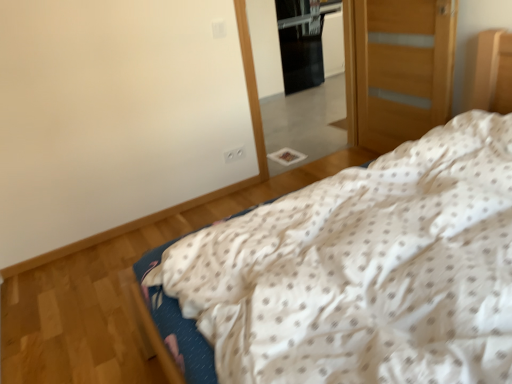
Identify the location of clear glass mirror at center. (298, 92).

In order to click on black glass screen door at upper center in this screenshot , I will do `click(300, 44)`.

The width and height of the screenshot is (512, 384). Find the location of `white dotted fabric at center`. white dotted fabric at center is located at coordinates (359, 270).

Find the location of `wooden door at right`. wooden door at right is located at coordinates (399, 69).

This screenshot has height=384, width=512. I want to click on clear glass mirror at center, so (x=298, y=92).

How much distance is there between wooden door at right and black glass screen door at upper center?

2.22 meters.

Is wooden door at right in contact with black glass screen door at upper center?

No.

Based on the photo, does wooden door at right lie in front of black glass screen door at upper center?

Yes, wooden door at right is in front of black glass screen door at upper center.

Is black glass screen door at upper center surrounded by wooden door at right?

No, black glass screen door at upper center is located outside of wooden door at right.

Are white dotted fabric at center and clear glass mirror at center located far from each other?

Absolutely, white dotted fabric at center is distant from clear glass mirror at center.

Is white dotted fabric at center at the left side of clear glass mirror at center?

Incorrect, white dotted fabric at center is not on the left side of clear glass mirror at center.

Looking at this image, which is in front, white dotted fabric at center or clear glass mirror at center?

Positioned in front is white dotted fabric at center.

Locate an element on the screen. bed below the clear glass mirror at center (from the image's perspective) is located at coordinates (359, 270).

Which of these two, black glass screen door at upper center or wooden door at right, is thinner?

wooden door at right is thinner.

Is black glass screen door at upper center surrounding wooden door at right?

That's incorrect, wooden door at right is not inside black glass screen door at upper center.

From the image's perspective, between black glass screen door at upper center and wooden door at right, which one is located above?

From the image's view, black glass screen door at upper center is above.

Is black glass screen door at upper center oriented away from wooden door at right?

No, wooden door at right is not at the back of black glass screen door at upper center.

Is point (383, 1) behind point (310, 129)?

No, (383, 1) is closer to viewer.

Based on the photo, is wooden door at right positioned beyond the bounds of clear glass mirror at center?

Yes, wooden door at right is not within clear glass mirror at center.

Looking at this image, what's the angular difference between wooden door at right and clear glass mirror at center's facing directions?

The angle between the facing direction of wooden door at right and the facing direction of clear glass mirror at center is 95.9 degrees.

How distant is wooden door at right from clear glass mirror at center?

wooden door at right is 35.45 inches from clear glass mirror at center.

From a real-world perspective, does white dotted fabric at center sit lower than wooden door at right?

No, from a real-world perspective, white dotted fabric at center is not under wooden door at right.

Is white dotted fabric at center outside of wooden door at right?

Yes, white dotted fabric at center is not within wooden door at right.

What's the angular difference between white dotted fabric at center and wooden door at right's facing directions?

6.25 degrees separate the facing orientations of white dotted fabric at center and wooden door at right.

From the picture: Considering the relative sizes of white dotted fabric at center and wooden door at right in the image provided, is white dotted fabric at center thinner than wooden door at right?

No, white dotted fabric at center is not thinner than wooden door at right.

Does point (256, 63) come in front of point (444, 4)?

No.

Considering the relative sizes of clear glass mirror at center and wooden door at right in the image provided, is clear glass mirror at center shorter than wooden door at right?

In fact, clear glass mirror at center may be taller than wooden door at right.

From the image's perspective, does clear glass mirror at center appear lower than wooden door at right?

No.

Does clear glass mirror at center contain wooden door at right?

No, wooden door at right is not a part of clear glass mirror at center.

Between clear glass mirror at center and black glass screen door at upper center, which one has larger size?

With larger size is black glass screen door at upper center.

Is clear glass mirror at center far away from black glass screen door at upper center?

clear glass mirror at center is near black glass screen door at upper center, not far away.

From the image's perspective, which one is positioned lower, clear glass mirror at center or black glass screen door at upper center?

clear glass mirror at center appears lower in the image.

Does clear glass mirror at center come behind black glass screen door at upper center?

That is False.

This screenshot has width=512, height=384. I want to click on screen door above the wooden door at right (from the image's perspective), so click(x=300, y=44).

Find the location of `bed positioned vertically above the clear glass mirror at center (from a real-world perspective)`. bed positioned vertically above the clear glass mirror at center (from a real-world perspective) is located at coordinates (359, 270).

Based on their spatial positions, is white dotted fabric at center or clear glass mirror at center further from black glass screen door at upper center?

white dotted fabric at center.

Based on their spatial positions, is white dotted fabric at center or wooden door at right further from clear glass mirror at center?

Based on the image, white dotted fabric at center appears to be further to clear glass mirror at center.

From the image, which object appears to be farther from black glass screen door at upper center, clear glass mirror at center or wooden door at right?

wooden door at right is positioned further to the anchor black glass screen door at upper center.

Estimate the real-world distances between objects in this image. Which object is closer to white dotted fabric at center, clear glass mirror at center or wooden door at right?

wooden door at right lies closer to white dotted fabric at center than the other object.

Based on the photo, from the image, which object appears to be nearer to wooden door at right, white dotted fabric at center or clear glass mirror at center?

The object closer to wooden door at right is clear glass mirror at center.

When comparing their distances from white dotted fabric at center, does clear glass mirror at center or black glass screen door at upper center seem closer?

clear glass mirror at center is closer to white dotted fabric at center.

From the image, which object appears to be nearer to black glass screen door at upper center, wooden door at right or clear glass mirror at center?

clear glass mirror at center is closer to black glass screen door at upper center.

Based on their spatial positions, is white dotted fabric at center or black glass screen door at upper center further from clear glass mirror at center?

white dotted fabric at center is positioned further to the anchor clear glass mirror at center.

You are a GUI agent. You are given a task and a screenshot of the screen. Output one action in this format:
    pyautogui.click(x=<x>, y=<y>)
    Task: Click on the door between white dotted fabric at center and black glass screen door at upper center from front to back
    
    Given the screenshot: What is the action you would take?
    pyautogui.click(x=399, y=69)

Find the location of a particular element. The image size is (512, 384). mirror positioned between white dotted fabric at center and black glass screen door at upper center from near to far is located at coordinates (298, 92).

Locate an element on the screen. mirror between wooden door at right and black glass screen door at upper center along the z-axis is located at coordinates (298, 92).

The image size is (512, 384). I want to click on door between white dotted fabric at center and clear glass mirror at center in the front-back direction, so click(399, 69).